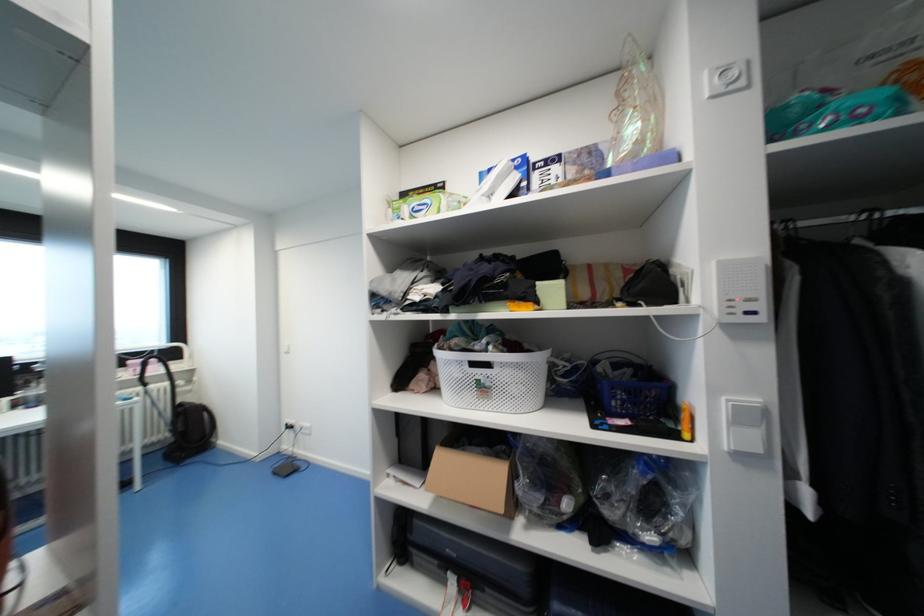
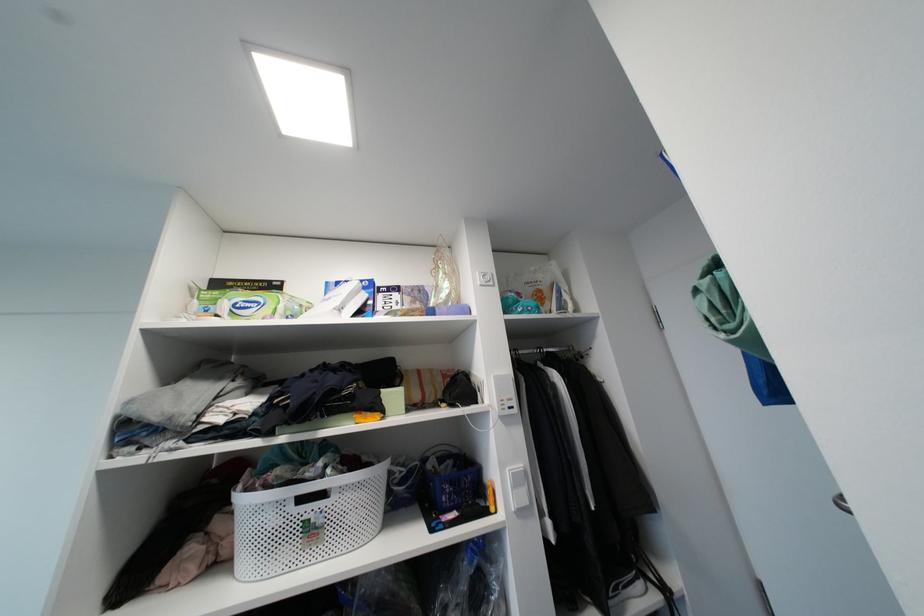
Locate, in the second image, the point that corresponds to (477,365) in the first image.

(306, 501)